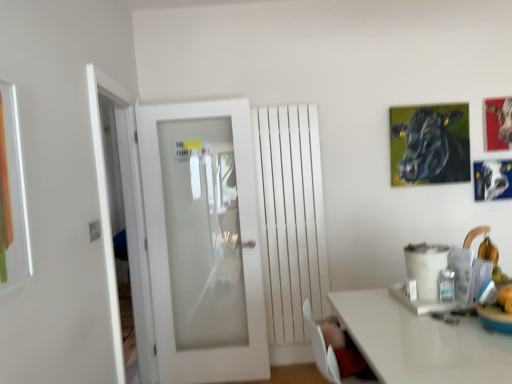
Question: Should I look upward or downward to see white frosted glass door at center?

Choices:
 (A) down
 (B) up

Answer: (A)

Question: Is metallic silver picture frame at upper right, acting as the 2th picture frame starting from the right, shorter than oil painting cow at upper right, which is the 1th picture frame from left to right?

Choices:
 (A) no
 (B) yes

Answer: (B)

Question: Is metallic silver picture frame at upper right, acting as the 2th picture frame starting from the right, oriented towards oil painting cow at upper right, which is the 1th picture frame from left to right?

Choices:
 (A) no
 (B) yes

Answer: (A)

Question: From a real-world perspective, is metallic silver picture frame at upper right, acting as the second picture frame starting from the left, on oil painting cow at upper right, which appears as the third picture frame when viewed from the right?

Choices:
 (A) yes
 (B) no

Answer: (B)

Question: Is metallic silver picture frame at upper right, acting as the 2th picture frame starting from the right, behind oil painting cow at upper right, which is the 1th picture frame from left to right?

Choices:
 (A) yes
 (B) no

Answer: (A)

Question: Is metallic silver picture frame at upper right, acting as the second picture frame starting from the left, to the right of oil painting cow at upper right, which is the 1th picture frame from left to right, from the viewer's perspective?

Choices:
 (A) yes
 (B) no

Answer: (A)

Question: From the image's perspective, is metallic silver picture frame at upper right, acting as the second picture frame starting from the left, beneath oil painting cow at upper right, which is the 1th picture frame from left to right?

Choices:
 (A) no
 (B) yes

Answer: (B)

Question: From a real-world perspective, is oil painting cow at upper right, which is the 1th picture frame from left to right, located higher than white frosted glass door at left?

Choices:
 (A) yes
 (B) no

Answer: (A)

Question: From the image's perspective, would you say oil painting cow at upper right, which appears as the third picture frame when viewed from the right, is positioned over white frosted glass door at left?

Choices:
 (A) no
 (B) yes

Answer: (B)

Question: Does oil painting cow at upper right, which appears as the third picture frame when viewed from the right, have a greater width compared to white frosted glass door at left?

Choices:
 (A) no
 (B) yes

Answer: (A)

Question: Is oil painting cow at upper right, which appears as the third picture frame when viewed from the right, to the left of white frosted glass door at left from the viewer's perspective?

Choices:
 (A) yes
 (B) no

Answer: (B)

Question: Considering the relative positions of oil painting cow at upper right, which is the 1th picture frame from left to right, and white frosted glass door at left in the image provided, is oil painting cow at upper right, which is the 1th picture frame from left to right, behind white frosted glass door at left?

Choices:
 (A) no
 (B) yes

Answer: (B)

Question: Considering the relative positions of oil painting cow at upper right, which appears as the third picture frame when viewed from the right, and white frosted glass door at left in the image provided, is oil painting cow at upper right, which appears as the third picture frame when viewed from the right, to the right of white frosted glass door at left from the viewer's perspective?

Choices:
 (A) yes
 (B) no

Answer: (A)

Question: Does white frosted glass door at center have a greater height compared to metallic silver picture frame at upper right, which is counted as the third picture frame, starting from the left?

Choices:
 (A) no
 (B) yes

Answer: (B)